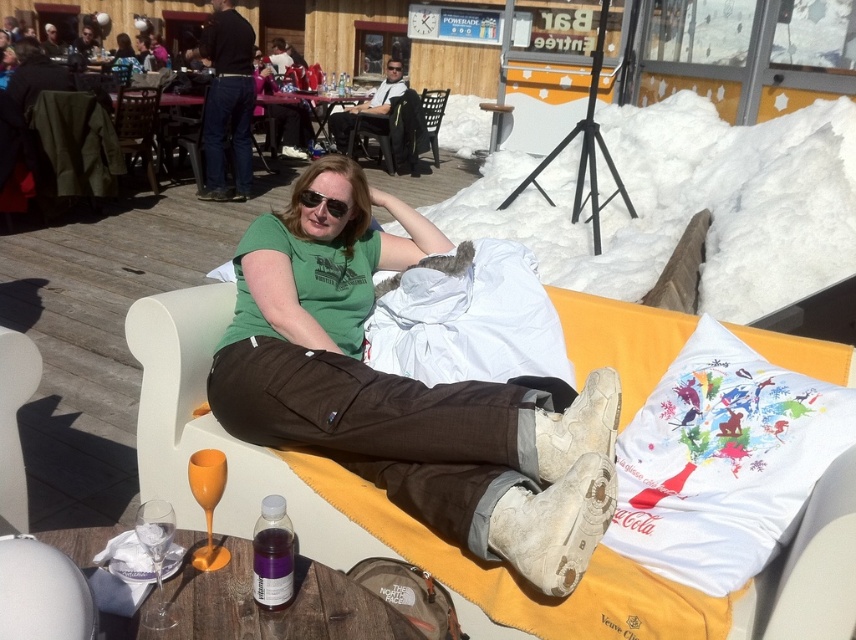
Question: Does green cotton shirt at center have a lesser width compared to white fabric daybed at center?

Choices:
 (A) yes
 (B) no

Answer: (A)

Question: Among these objects, which one is nearest to the camera?

Choices:
 (A) white fabric pillow at lower right
 (B) black plastic sunglasses at center
 (C) green cotton shirt at center
 (D) white fabric daybed at center

Answer: (C)

Question: Which object is closer to the camera taking this photo?

Choices:
 (A) green cotton shirt at center
 (B) black plastic sunglasses at center
 (C) white fabric pillow at lower right
 (D) white fabric daybed at center

Answer: (A)

Question: Which point is closer to the camera taking this photo?

Choices:
 (A) (643, 342)
 (B) (296, 195)
 (C) (520, 472)
 (D) (783, 403)

Answer: (C)

Question: Is white fabric daybed at center behind black plastic sunglasses at center?

Choices:
 (A) no
 (B) yes

Answer: (A)

Question: Is green cotton shirt at center further to the viewer compared to white fabric pillow at lower right?

Choices:
 (A) yes
 (B) no

Answer: (B)